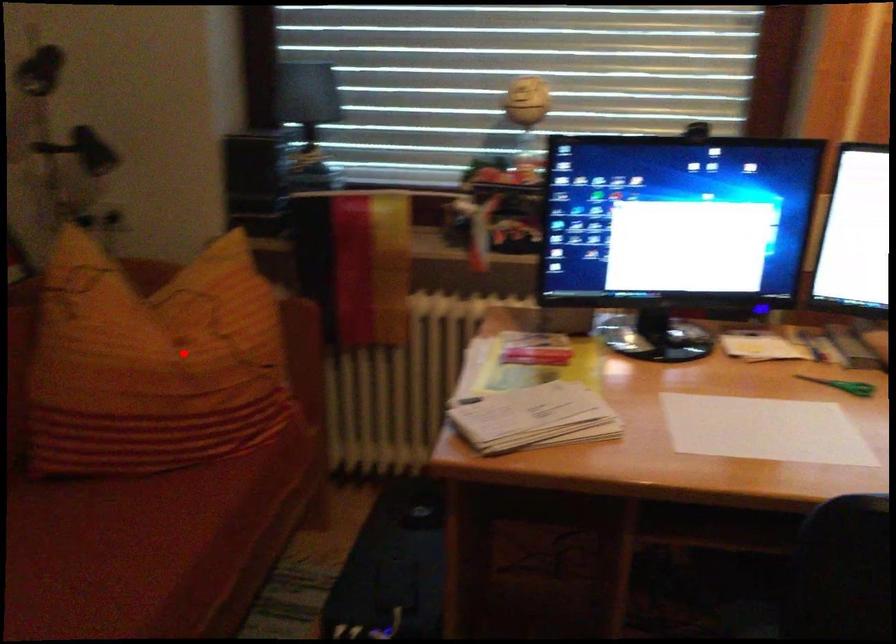
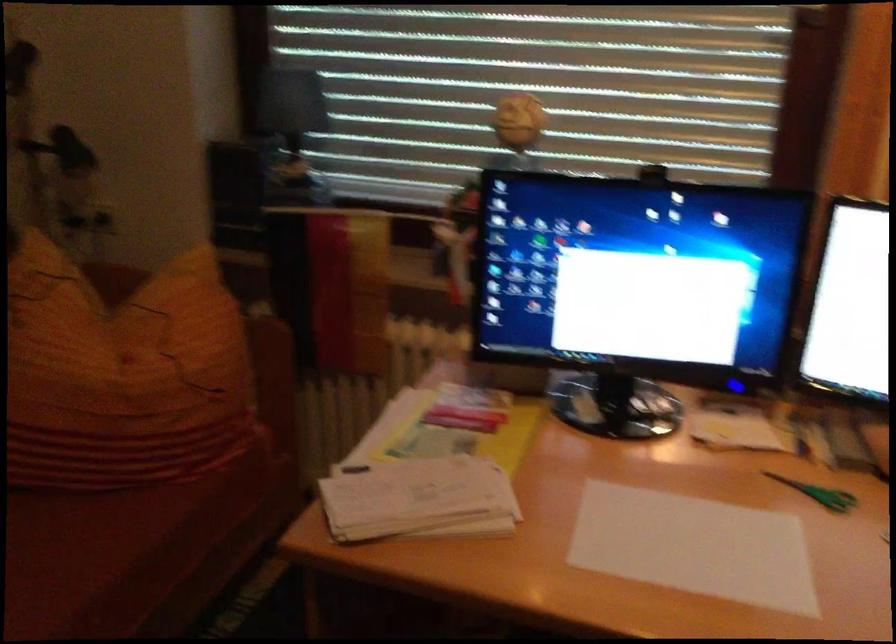
The point at the highlighted location is marked in the first image. Where is the corresponding point in the second image?

(122, 374)